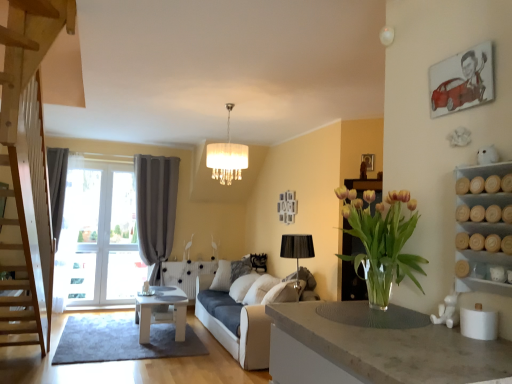
This screenshot has height=384, width=512. Describe the element at coordinates (234, 325) in the screenshot. I see `white fabric couch at center` at that location.

At what (x,y) coordinates should I click in order to perform the action: click on white textured pillow at center. Please return your answer as a coordinate pair (x, y). This screenshot has width=512, height=384. Looking at the image, I should click on (230, 273).

Image resolution: width=512 pixels, height=384 pixels. What do you see at coordinates (230, 273) in the screenshot?
I see `white textured pillow at center` at bounding box center [230, 273].

What is the approximate height of white fabric lampshade at center?

white fabric lampshade at center is 76.29 centimeters in height.

Image resolution: width=512 pixels, height=384 pixels. I want to click on wooden cylindrical containers at right, so click(483, 280).

You are a GUI agent. You are given a task and a screenshot of the screen. Output one action in this format:
    pyautogui.click(x=<x>, y=<y>)
    Task: Click on the translucent glass vase at center
    
    Given the screenshot: What is the action you would take?
    pyautogui.click(x=382, y=243)

The width and height of the screenshot is (512, 384). Describe the element at coordinates (161, 312) in the screenshot. I see `white wood table at center` at that location.

At what (x,y) coordinates should I click in order to perform the action: click on white fabric couch at center. Please return your answer as a coordinate pair (x, y). Looking at the image, I should click on 234,325.

Can you see white wood table at center touching white textured pillow at center?

No.

Does white wood table at center turn towards white textured pillow at center?

No, white wood table at center does not turn towards white textured pillow at center.

In terms of size, does white wood table at center appear bigger or smaller than white textured pillow at center?

Clearly, white wood table at center is larger in size than white textured pillow at center.

Is white fabric couch at center turned away from wooden cylindrical containers at right?

No.

How many degrees apart are the facing directions of white fabric couch at center and wooden cylindrical containers at right?

The angle between the facing direction of white fabric couch at center and the facing direction of wooden cylindrical containers at right is 0.318 degrees.

Which object is wider, white fabric couch at center or wooden cylindrical containers at right?

Wider between the two is white fabric couch at center.

Is white fabric couch at center situated inside wooden cylindrical containers at right or outside?

The correct answer is: outside.

From the picture: From a real-world perspective, is gray fabric curtain at left physically located above or below white wood table at center?

gray fabric curtain at left is above white wood table at center.

Consider the image. Would you say white wood table at center is part of gray fabric curtain at left's contents?

No, gray fabric curtain at left does not contain white wood table at center.

From the image's perspective, which object appears higher, gray fabric curtain at left or white wood table at center?

gray fabric curtain at left, from the image's perspective.

Which object is closer to the camera, gray fabric curtain at left or white wood table at center?

white wood table at center is in front.

Is white wood table at center facing away from white fabric lampshade at center?

white wood table at center does not have its back to white fabric lampshade at center.

Is white wood table at center outside of white fabric lampshade at center?

That's correct, white wood table at center is outside of white fabric lampshade at center.

From a real-world perspective, who is located higher, white wood table at center or white fabric lampshade at center?

From a 3D spatial view, white fabric lampshade at center is above.

Are white fabric lampshade at center and white fabric couch at center located far from each other?

white fabric lampshade at center is far away from white fabric couch at center.

From the image's perspective, who appears lower, white fabric lampshade at center or white fabric couch at center?

white fabric couch at center appears lower in the image.

In terms of width, does white fabric lampshade at center look wider or thinner when compared to white fabric couch at center?

Considering their sizes, white fabric lampshade at center looks slimmer than white fabric couch at center.

How different are the orientations of white fabric lampshade at center and white fabric couch at center in degrees?

They differ by 2.42 degrees in their facing directions.

Between gray fabric curtain at left and wooden picture frame at upper center, which one has larger width?

With larger width is gray fabric curtain at left.

Does point (161, 157) come closer to viewer compared to point (374, 158)?

That is False.

From the picture: Is gray fabric curtain at left looking in the opposite direction of wooden picture frame at upper center?

That's not correct — gray fabric curtain at left is not looking away from wooden picture frame at upper center.

From a real-world perspective, which object rests below the other?

gray fabric curtain at left is physically lower.

The width and height of the screenshot is (512, 384). I want to click on cabinet in front of the white wood table at center, so click(x=483, y=280).

Considering the positions of objects wooden cylindrical containers at right and white wood table at center in the image provided, who is more to the left, wooden cylindrical containers at right or white wood table at center?

white wood table at center is more to the left.

Is white wood table at center surrounded by wooden cylindrical containers at right?

No, white wood table at center is not surrounded by wooden cylindrical containers at right.

Find the location of a particular element. table below the white textured pillow at center (from the image's perspective) is located at coordinates (161, 312).

Identify the location of cabinet on the right of white fabric couch at center. (483, 280).

Which object lies nearer to the anchor point white fabric lampshade at center, gray fabric curtain at left or white fabric couch at center?

white fabric couch at center is closer to white fabric lampshade at center.

Which object lies nearer to the anchor point gray fabric curtain at left, white textured pillow at center or white fabric couch at center?

Based on the image, white textured pillow at center appears to be nearer to gray fabric curtain at left.

Which object lies nearer to the anchor point translucent glass vase at center, wooden picture frame at upper center or gray fabric curtain at left?

Based on the image, wooden picture frame at upper center appears to be nearer to translucent glass vase at center.

Considering their positions, is translucent glass vase at center positioned closer to white fabric couch at center than white fabric lampshade at center?

Among the two, white fabric lampshade at center is located nearer to white fabric couch at center.

Based on the photo, from the image, which object appears to be farther from gray fabric curtain at left, white fabric lampshade at center or wooden cylindrical containers at right?

wooden cylindrical containers at right.

From the image, which object appears to be nearer to wooden cylindrical containers at right, gray fabric curtain at left or white textured pillow at center?

white textured pillow at center lies closer to wooden cylindrical containers at right than the other object.

Looking at the image, which one is located closer to wooden cylindrical containers at right, white fabric couch at center or white textured pillow at center?

white fabric couch at center lies closer to wooden cylindrical containers at right than the other object.

Considering their positions, is gray fabric curtain at left positioned closer to translucent glass vase at center than wooden picture frame at upper center?

wooden picture frame at upper center lies closer to translucent glass vase at center than the other object.

Locate an element on the screen. The image size is (512, 384). table between white fabric couch at center and white textured pillow at center in the front-back direction is located at coordinates (161, 312).

At what (x,y) coordinates should I click in order to perform the action: click on studio couch located between gray fabric curtain at left and wooden picture frame at upper center in the left-right direction. Please return your answer as a coordinate pair (x, y). The image size is (512, 384). Looking at the image, I should click on point(234,325).

This screenshot has height=384, width=512. I want to click on studio couch between white fabric lampshade at center and gray fabric curtain at left from front to back, so click(x=234, y=325).

Where is `pillow between wooden cylindrical containers at right and gray fabric curtain at left from front to back`? The image size is (512, 384). pillow between wooden cylindrical containers at right and gray fabric curtain at left from front to back is located at coordinates (230, 273).